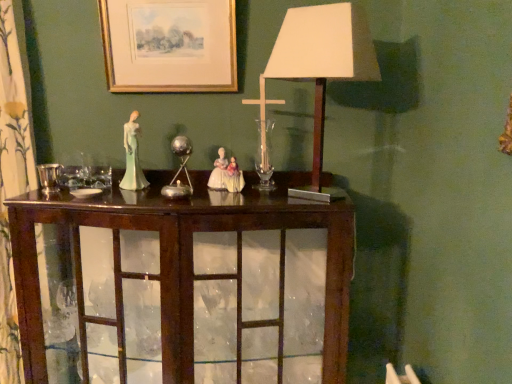
Find the location of a particular element. The width and height of the screenshot is (512, 384). free space to the back side of shiny silver candle holder at left, marked as the second candle holder in a right-to-left arrangement is located at coordinates (67, 187).